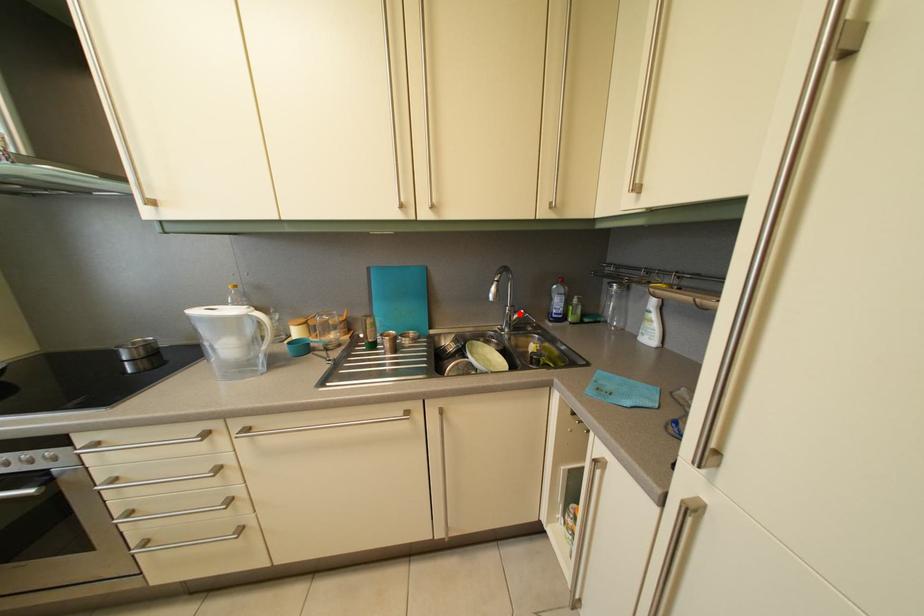
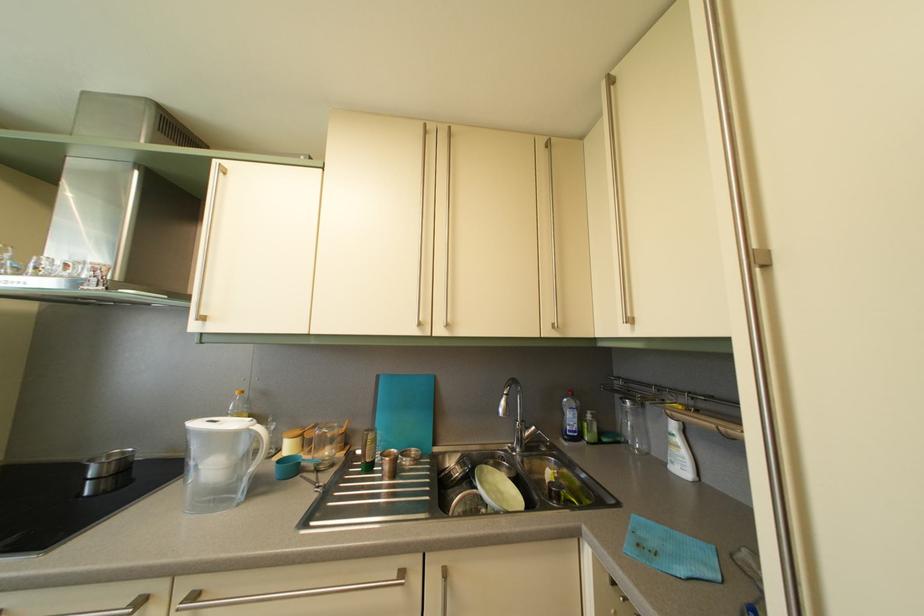
Question: I am providing you with two images of the same scene from different viewpoints. In image1, a red point is highlighted. Considering the same 3D point in image2, which of the following is correct?

Choices:
 (A) It is closer
 (B) It is farther

Answer: (B)